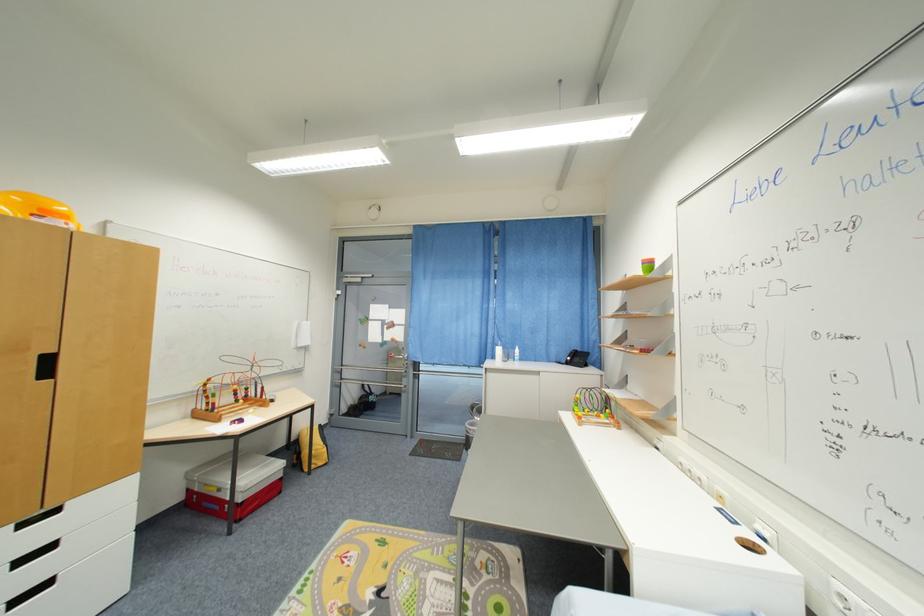
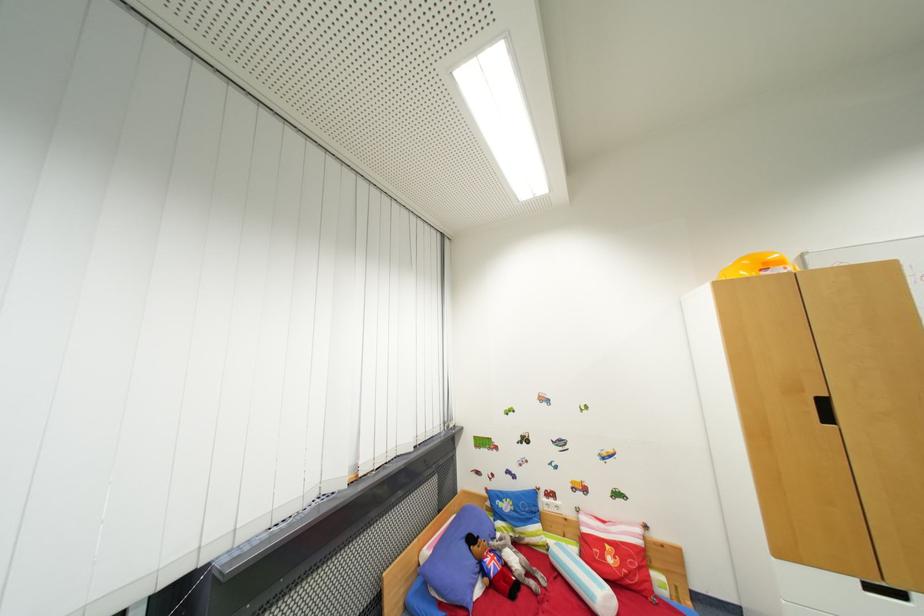
Locate, in the second image, the point that corresponds to (52,376) in the first image.

(833, 419)